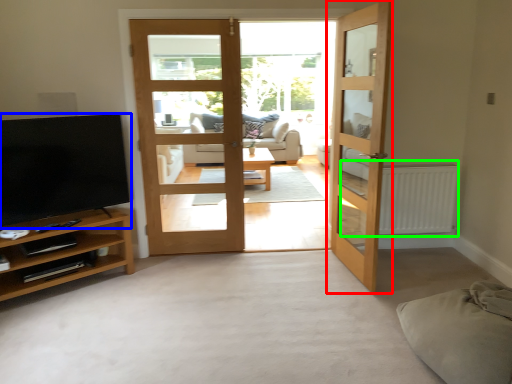
Question: Which object is positioned closest to door (highlighted by a red box)? Select from television (highlighted by a blue box) and radiator (highlighted by a green box).

Choices:
 (A) television
 (B) radiator

Answer: (B)